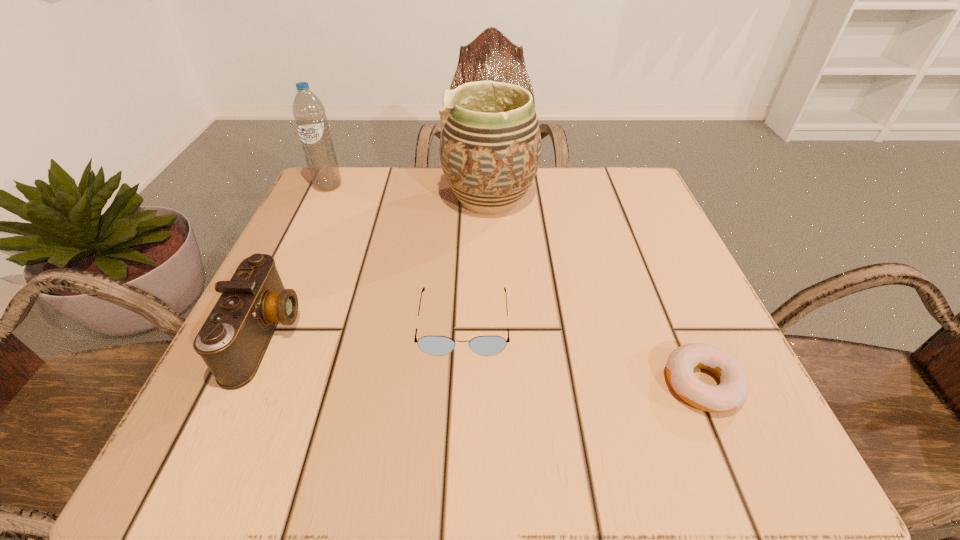
The height and width of the screenshot is (540, 960). I want to click on pottery, so click(x=490, y=144).

The image size is (960, 540). What are the coordinates of `water bottle` in the screenshot? It's located at (309, 113).

The image size is (960, 540). I want to click on camera, so click(x=232, y=342).

Locate an element on the screen. This screenshot has width=960, height=540. the fourth tallest object is located at coordinates (432, 345).

Where is `the rightmost object`? The height and width of the screenshot is (540, 960). the rightmost object is located at coordinates (732, 392).

Identify the location of the shortest object. (732, 392).

The width and height of the screenshot is (960, 540). What are the coordinates of `vacant position located on the right of the pottery` in the screenshot? It's located at (573, 198).

Locate an element on the screen. The image size is (960, 540). free space located 0.240m on the front of the water bottle is located at coordinates (291, 266).

This screenshot has width=960, height=540. Find the location of `free space located 0.200m on the lens of the third shortest object`. free space located 0.200m on the lens of the third shortest object is located at coordinates (426, 335).

Where is `free region located 0.100m on the lenses of the second shortest object`? The height and width of the screenshot is (540, 960). free region located 0.100m on the lenses of the second shortest object is located at coordinates (460, 420).